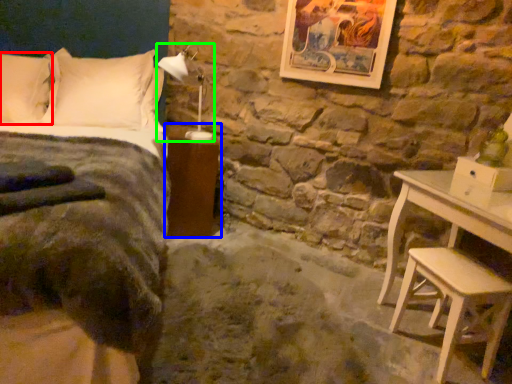
Question: Which object is the farthest from pillow (highlighted by a red box)? Choose among these: nightstand (highlighted by a blue box) or lamp (highlighted by a green box).

Choices:
 (A) nightstand
 (B) lamp

Answer: (A)